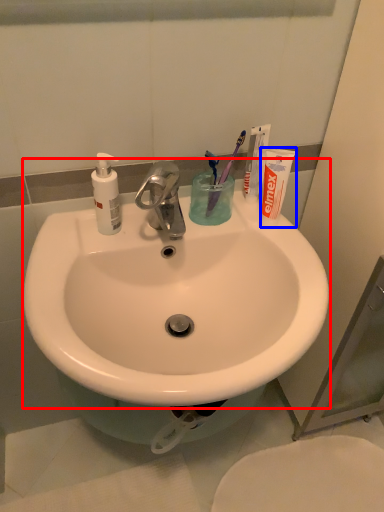
Question: Which object is further to the camera taking this photo, sink (highlighted by a red box) or toiletry (highlighted by a blue box)?

Choices:
 (A) sink
 (B) toiletry

Answer: (B)